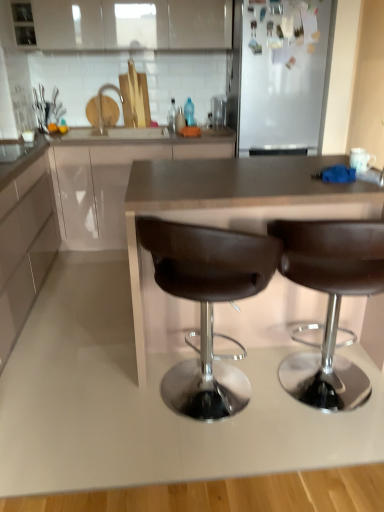
What do you see at coordinates (131, 25) in the screenshot? I see `white glossy cabinet at upper center, which is the first cabinetry in top-to-bottom order` at bounding box center [131, 25].

What is the approximate height of brushed metal faucet at upper center?

13.88 inches.

At what (x,y) coordinates should I click in order to perform the action: click on white matte refrigerator at upper center. Please return your answer as a coordinate pair (x, y). Looking at the image, I should click on (284, 75).

I want to click on appliance that appears above the white glossy cabinet at left, acting as the 1th cabinetry starting from the bottom (from the image's perspective), so click(x=284, y=75).

Considering the sizes of objects white matte refrigerator at upper center and white glossy cabinet at left, acting as the 1th cabinetry starting from the bottom, in the image provided, who is thinner, white matte refrigerator at upper center or white glossy cabinet at left, acting as the 1th cabinetry starting from the bottom,?

white glossy cabinet at left, acting as the 1th cabinetry starting from the bottom, is thinner.

Could white glossy cabinet at left, positioned as the 3th cabinetry in top-to-bottom order, be considered to be inside white matte refrigerator at upper center?

Definitely not — white glossy cabinet at left, positioned as the 3th cabinetry in top-to-bottom order, is not inside white matte refrigerator at upper center.

Is white matte refrigerator at upper center aimed at white glossy cabinet at left, positioned as the 3th cabinetry in top-to-bottom order?

No, white matte refrigerator at upper center is not aimed at white glossy cabinet at left, positioned as the 3th cabinetry in top-to-bottom order.

Considering the relative positions of brown leather countertop at center and white glossy cabinet at upper center, which is the first cabinetry in top-to-bottom order, in the image provided, is brown leather countertop at center to the left of white glossy cabinet at upper center, which is the first cabinetry in top-to-bottom order, from the viewer's perspective?

Incorrect, brown leather countertop at center is not on the left side of white glossy cabinet at upper center, which is the first cabinetry in top-to-bottom order.

Is brown leather countertop at center not inside white glossy cabinet at upper center, which is the first cabinetry in top-to-bottom order?

Yes, brown leather countertop at center is not within white glossy cabinet at upper center, which is the first cabinetry in top-to-bottom order.

Is point (172, 202) closer or farther from the camera than point (65, 5)?

Point (172, 202).

From the image's perspective, which object appears higher, brown leather countertop at center or white glossy cabinet at upper center, arranged as the 3th cabinetry when ordered from the bottom?

white glossy cabinet at upper center, arranged as the 3th cabinetry when ordered from the bottom, appears higher in the image.

Can you tell me how much white glossy cabinet at upper center, which is the first cabinetry in top-to-bottom order, and white glossy cabinet at left, positioned as the 3th cabinetry in top-to-bottom order, differ in facing direction?

90 degrees.

From the image's perspective, is white glossy cabinet at upper center, arranged as the 3th cabinetry when ordered from the bottom, located above white glossy cabinet at left, positioned as the 3th cabinetry in top-to-bottom order?

Correct, white glossy cabinet at upper center, arranged as the 3th cabinetry when ordered from the bottom, appears higher than white glossy cabinet at left, positioned as the 3th cabinetry in top-to-bottom order, in the image.

From a real-world perspective, relative to white glossy cabinet at left, positioned as the 3th cabinetry in top-to-bottom order, is white glossy cabinet at upper center, which is the first cabinetry in top-to-bottom order, vertically above or below?

In terms of real-world spatial position, white glossy cabinet at upper center, which is the first cabinetry in top-to-bottom order, is above white glossy cabinet at left, positioned as the 3th cabinetry in top-to-bottom order.

Can we say white glossy cabinet at upper center, which is the first cabinetry in top-to-bottom order, lies outside white glossy cabinet at left, acting as the 1th cabinetry starting from the bottom?

That's correct, white glossy cabinet at upper center, which is the first cabinetry in top-to-bottom order, is outside of white glossy cabinet at left, acting as the 1th cabinetry starting from the bottom.

Is matte white cabinet at center, positioned as the 2th cabinetry in bottom-to-top order, not near white matte refrigerator at upper center?

No, there isn't a large distance between matte white cabinet at center, positioned as the 2th cabinetry in bottom-to-top order, and white matte refrigerator at upper center.

In terms of width, does matte white cabinet at center, positioned as the 2th cabinetry in bottom-to-top order, look wider or thinner when compared to white matte refrigerator at upper center?

In the image, matte white cabinet at center, positioned as the 2th cabinetry in bottom-to-top order, appears to be wider than white matte refrigerator at upper center.

Based on their positions, is matte white cabinet at center, positioned as the 2th cabinetry in bottom-to-top order, located to the left or right of white matte refrigerator at upper center?

From the image, it's evident that matte white cabinet at center, positioned as the 2th cabinetry in bottom-to-top order, is to the left of white matte refrigerator at upper center.

Is matte white cabinet at center, placed as the 2th cabinetry when sorted from top to bottom, smaller than white matte refrigerator at upper center?

Incorrect, matte white cabinet at center, placed as the 2th cabinetry when sorted from top to bottom, is not smaller in size than white matte refrigerator at upper center.

Is white glossy cabinet at upper center, which is the first cabinetry in top-to-bottom order, positioned in front of matte white cabinet at center, positioned as the 2th cabinetry in bottom-to-top order?

That is False.

Which point is more forward, [156,8] or [228,148]?

The point [228,148] is in front.

From the image's perspective, does white glossy cabinet at upper center, which is the first cabinetry in top-to-bottom order, appear higher than matte white cabinet at center, placed as the 2th cabinetry when sorted from top to bottom?

Yes, from the image's perspective, white glossy cabinet at upper center, which is the first cabinetry in top-to-bottom order, is on top of matte white cabinet at center, placed as the 2th cabinetry when sorted from top to bottom.

Based on the photo, considering the relative positions of white glossy cabinet at upper center, which is the first cabinetry in top-to-bottom order, and matte white cabinet at center, placed as the 2th cabinetry when sorted from top to bottom, in the image provided, is white glossy cabinet at upper center, which is the first cabinetry in top-to-bottom order, to the left of matte white cabinet at center, placed as the 2th cabinetry when sorted from top to bottom, from the viewer's perspective?

No, white glossy cabinet at upper center, which is the first cabinetry in top-to-bottom order, is not to the left of matte white cabinet at center, placed as the 2th cabinetry when sorted from top to bottom.

Is matte white cabinet at center, placed as the 2th cabinetry when sorted from top to bottom, not near brushed metal faucet at upper center?

matte white cabinet at center, placed as the 2th cabinetry when sorted from top to bottom, is actually quite close to brushed metal faucet at upper center.

Is matte white cabinet at center, placed as the 2th cabinetry when sorted from top to bottom, positioned with its back to brushed metal faucet at upper center?

No, matte white cabinet at center, placed as the 2th cabinetry when sorted from top to bottom,'s orientation is not away from brushed metal faucet at upper center.

Does matte white cabinet at center, positioned as the 2th cabinetry in bottom-to-top order, have a larger size compared to brushed metal faucet at upper center?

Indeed, matte white cabinet at center, positioned as the 2th cabinetry in bottom-to-top order, has a larger size compared to brushed metal faucet at upper center.

Does matte white cabinet at center, placed as the 2th cabinetry when sorted from top to bottom, have a lesser height compared to brushed metal faucet at upper center?

No, matte white cabinet at center, placed as the 2th cabinetry when sorted from top to bottom, is not shorter than brushed metal faucet at upper center.

In the scene shown: How far apart are brown leather stool at center, acting as the 2th chair starting from the left, and brown leather countertop at center?

brown leather stool at center, acting as the 2th chair starting from the left, is 40.65 centimeters away from brown leather countertop at center.

Is brown leather stool at center, the first chair from the right, taller or shorter than brown leather countertop at center?

brown leather stool at center, the first chair from the right, is shorter than brown leather countertop at center.

Does brown leather stool at center, acting as the 2th chair starting from the left, have a lesser width compared to brown leather countertop at center?

Yes.

In the scene shown: Is brown leather stool at center, the first chair from the right, far away from brown leather countertop at center?

No, brown leather stool at center, the first chair from the right, is not far from brown leather countertop at center.

There is a white matte refrigerator at upper center. Identify the location of the 2nd cabinetry below it (from the image's perspective). Image resolution: width=384 pixels, height=512 pixels. (25, 247).

Where is `the 3rd cabinetry above the brown leather countertop at center (from the image's perspective)`? the 3rd cabinetry above the brown leather countertop at center (from the image's perspective) is located at coordinates (131, 25).

Which object lies nearer to the anchor point matte white cabinet at center, positioned as the 2th cabinetry in bottom-to-top order, brushed metal faucet at upper center or brown leather stool at center, the first chair when ordered from left to right?

Among the two, brushed metal faucet at upper center is located nearer to matte white cabinet at center, positioned as the 2th cabinetry in bottom-to-top order.

Based on their spatial positions, is white matte refrigerator at upper center or brown leather stool at center, acting as the 2th chair starting from the left, closer to white glossy cabinet at upper center, arranged as the 3th cabinetry when ordered from the bottom?

white matte refrigerator at upper center lies closer to white glossy cabinet at upper center, arranged as the 3th cabinetry when ordered from the bottom, than the other object.

Which object lies nearer to the anchor point white matte refrigerator at upper center, brushed metal faucet at upper center or brown leather countertop at center?

brown leather countertop at center lies closer to white matte refrigerator at upper center than the other object.

Based on their spatial positions, is brown leather countertop at center or brown leather stool at center, acting as the 2th chair starting from the left, further from matte white cabinet at center, positioned as the 2th cabinetry in bottom-to-top order?

brown leather stool at center, acting as the 2th chair starting from the left, lies further to matte white cabinet at center, positioned as the 2th cabinetry in bottom-to-top order, than the other object.

Which object lies further to the anchor point white glossy cabinet at left, acting as the 1th cabinetry starting from the bottom, brown leather stool at center, the first chair when ordered from left to right, or brown leather stool at center, the first chair from the right?

brown leather stool at center, the first chair from the right, lies further to white glossy cabinet at left, acting as the 1th cabinetry starting from the bottom, than the other object.

Estimate the real-world distances between objects in this image. Which object is closer to white matte refrigerator at upper center, brown leather stool at center, the 2th chair when ordered from right to left, or brown leather stool at center, the first chair from the right?

brown leather stool at center, the first chair from the right.

Estimate the real-world distances between objects in this image. Which object is closer to brown leather stool at center, acting as the 2th chair starting from the left, white matte refrigerator at upper center or white glossy cabinet at upper center, which is the first cabinetry in top-to-bottom order?

Based on the image, white matte refrigerator at upper center appears to be nearer to brown leather stool at center, acting as the 2th chair starting from the left.

When comparing their distances from white glossy cabinet at upper center, which is the first cabinetry in top-to-bottom order, does brown leather stool at center, the first chair from the right, or white matte refrigerator at upper center seem further?

brown leather stool at center, the first chair from the right, lies further to white glossy cabinet at upper center, which is the first cabinetry in top-to-bottom order, than the other object.

Locate an element on the screen. This screenshot has height=512, width=384. countertop between white matte refrigerator at upper center and brown leather stool at center, the first chair when ordered from left to right, in the up-down direction is located at coordinates (227, 214).

In order to click on silver situated between white glossy cabinet at left, acting as the 1th cabinetry starting from the bottom, and white matte refrigerator at upper center from left to right in this screenshot , I will do `click(100, 99)`.

Where is `chair between white matte refrigerator at upper center and brown leather stool at center, the first chair when ordered from left to right, from top to bottom`? chair between white matte refrigerator at upper center and brown leather stool at center, the first chair when ordered from left to right, from top to bottom is located at coordinates (330, 302).

Where is `appliance positioned between brown leather stool at center, the first chair when ordered from left to right, and brushed metal faucet at upper center from near to far`? This screenshot has height=512, width=384. appliance positioned between brown leather stool at center, the first chair when ordered from left to right, and brushed metal faucet at upper center from near to far is located at coordinates (284, 75).